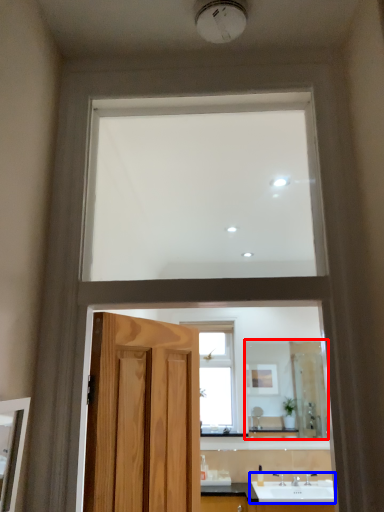
Question: Which point is closer to the camera, mirror (highlighted by a red box) or sink (highlighted by a blue box)?

Choices:
 (A) mirror
 (B) sink

Answer: (B)